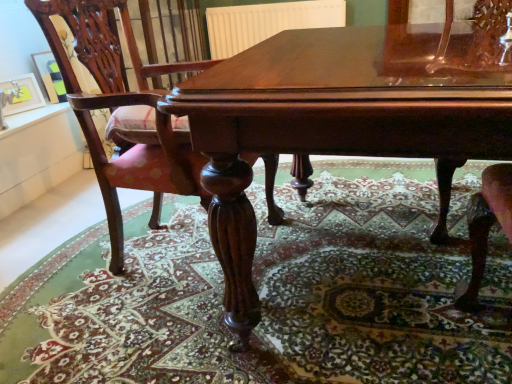
Question: Should I look upward or downward to see carpeted floor at center?

Choices:
 (A) up
 (B) down

Answer: (B)

Question: Does polished wood table at center appear on the left side of carpeted floor at center?

Choices:
 (A) yes
 (B) no

Answer: (B)

Question: Does polished wood table at center have a lesser height compared to carpeted floor at center?

Choices:
 (A) yes
 (B) no

Answer: (B)

Question: Is polished wood table at center thinner than carpeted floor at center?

Choices:
 (A) no
 (B) yes

Answer: (B)

Question: From the image's perspective, is polished wood table at center under carpeted floor at center?

Choices:
 (A) yes
 (B) no

Answer: (B)

Question: From the image's perspective, is polished wood table at center on top of carpeted floor at center?

Choices:
 (A) yes
 (B) no

Answer: (A)

Question: From a real-world perspective, is polished wood table at center below carpeted floor at center?

Choices:
 (A) yes
 (B) no

Answer: (B)

Question: Is carpeted floor at center far from brushed metal picture frame at upper left, which is counted as the 1th picture frame, starting from the front?

Choices:
 (A) yes
 (B) no

Answer: (A)

Question: Is carpeted floor at center closer to camera compared to brushed metal picture frame at upper left, arranged as the second picture frame when viewed from the back?

Choices:
 (A) no
 (B) yes

Answer: (B)

Question: Is carpeted floor at center further to camera compared to brushed metal picture frame at upper left, arranged as the second picture frame when viewed from the back?

Choices:
 (A) no
 (B) yes

Answer: (A)

Question: Is carpeted floor at center at the right side of brushed metal picture frame at upper left, arranged as the second picture frame when viewed from the back?

Choices:
 (A) yes
 (B) no

Answer: (A)

Question: Is carpeted floor at center taller than brushed metal picture frame at upper left, arranged as the second picture frame when viewed from the back?

Choices:
 (A) no
 (B) yes

Answer: (A)

Question: Is carpeted floor at center placed right next to brushed metal picture frame at upper left, which is counted as the 1th picture frame, starting from the front?

Choices:
 (A) no
 (B) yes

Answer: (A)

Question: From a real-world perspective, does matte black picture frame at upper left, which is the 2th picture frame from front to back, stand above polished wood chair at center?

Choices:
 (A) yes
 (B) no

Answer: (A)